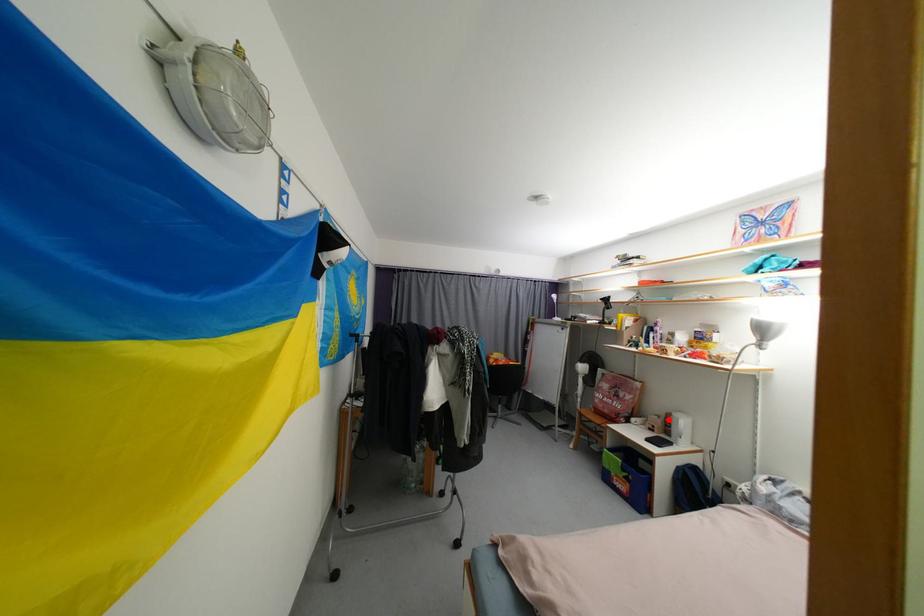
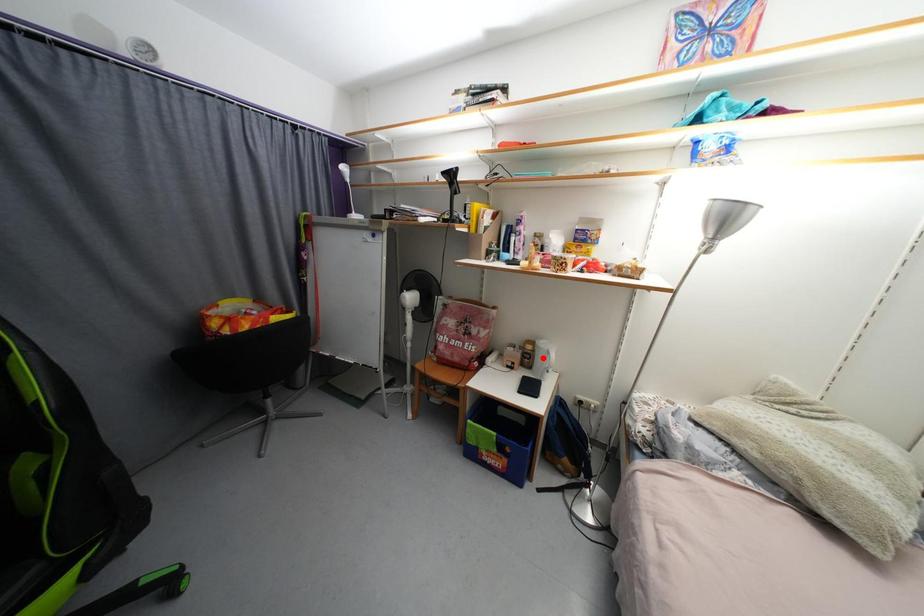
I am providing you with two images of the same scene from different viewpoints. A red point is marked on the first image and another point is marked on the second image. Is the marked point in image1 the same physical position as the marked point in image2?

No